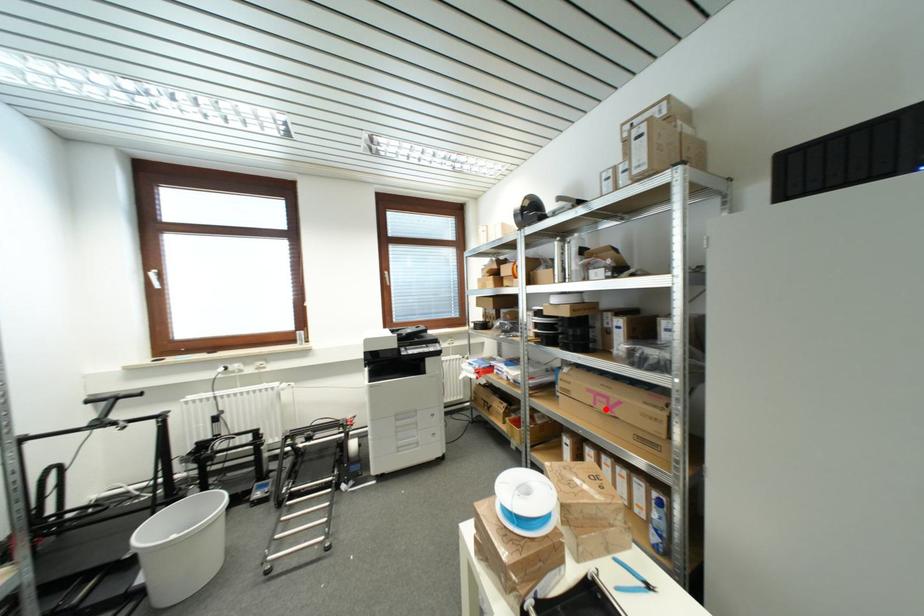
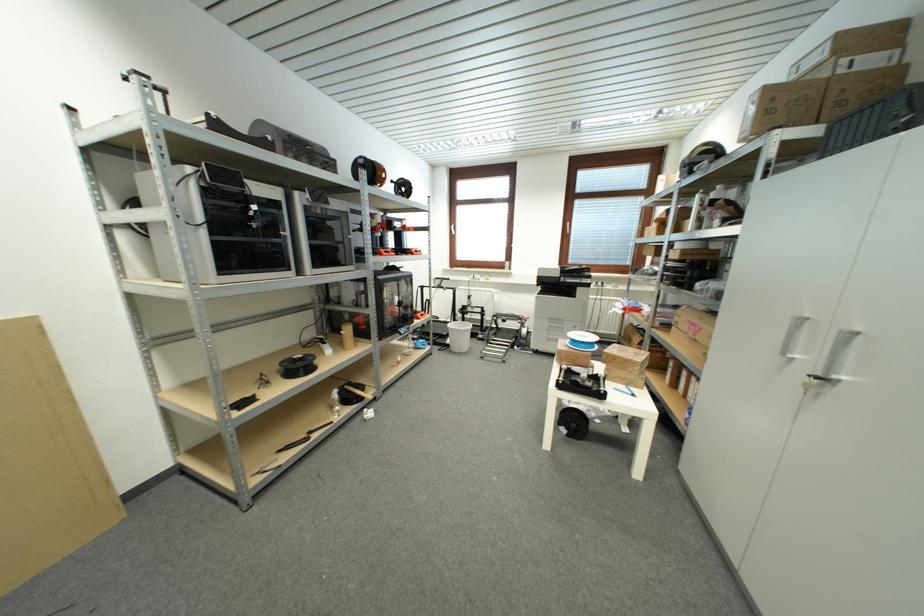
The point at the highlighted location is marked in the first image. Where is the corresponding point in the second image?

(696, 334)